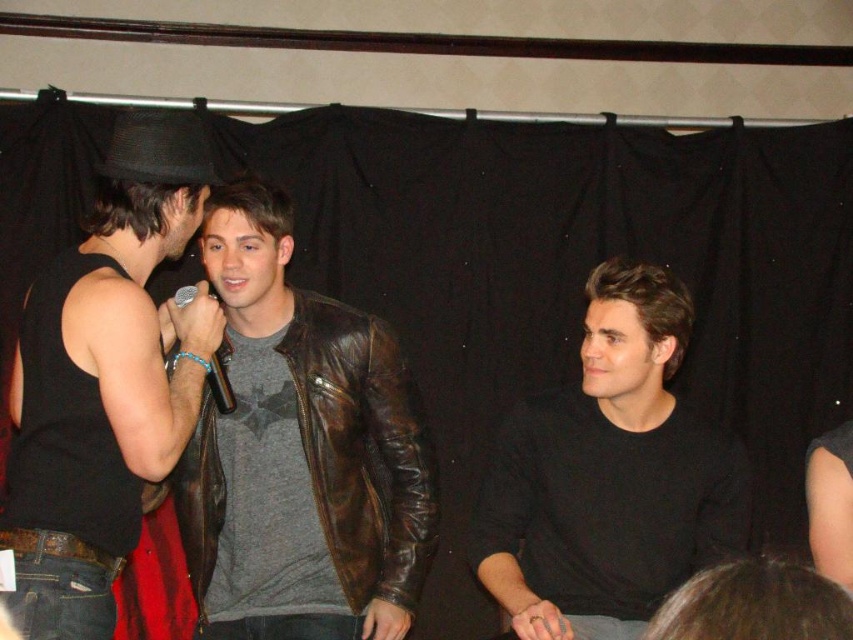
Based on the photo, is brown leather jacket at center taller than metallic silver microphone at center?

Yes, brown leather jacket at center is taller than metallic silver microphone at center.

Between brown leather jacket at center and metallic silver microphone at center, which one is positioned higher?

metallic silver microphone at center is above.

Measure the distance between point (383, 483) and camera.

6.69 feet

The width and height of the screenshot is (853, 640). Identify the location of brown leather jacket at center. (363, 449).

Can you confirm if black leather jacket at left is taller than metallic silver microphone at center?

Correct, black leather jacket at left is much taller as metallic silver microphone at center.

Is black leather jacket at left above metallic silver microphone at center?

Incorrect, black leather jacket at left is not positioned above metallic silver microphone at center.

Is point (177, 316) more distant than point (190, 289)?

No.

This screenshot has width=853, height=640. Identify the location of black leather jacket at left. coord(105,380).

Looking at this image, between black leather jacket at left and black matte shirt at center, which one has less height?

With less height is black matte shirt at center.

Is point (164, 468) farther from camera compared to point (491, 561)?

No, it is not.

Which is in front, point (71, 452) or point (567, 563)?

Point (71, 452)

Where is `black leather jacket at left`? This screenshot has width=853, height=640. black leather jacket at left is located at coordinates (105, 380).